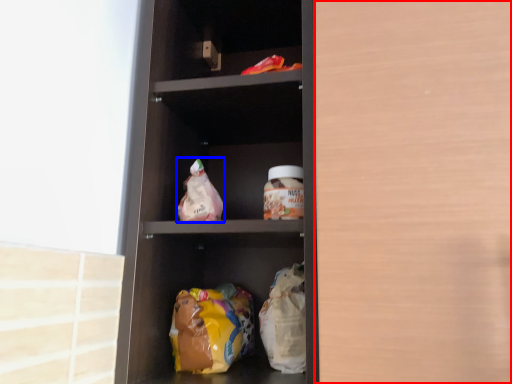
Question: Among these objects, which one is farthest to the camera, glass door (highlighted by a red box) or snack (highlighted by a blue box)?

Choices:
 (A) glass door
 (B) snack

Answer: (B)